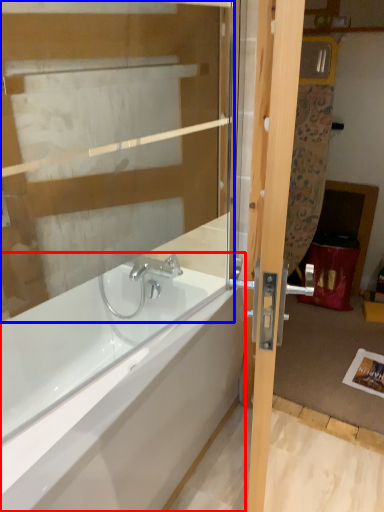
Question: Which object appears farthest to the camera in this image, bathtub (highlighted by a red box) or glass door (highlighted by a blue box)?

Choices:
 (A) bathtub
 (B) glass door

Answer: (A)